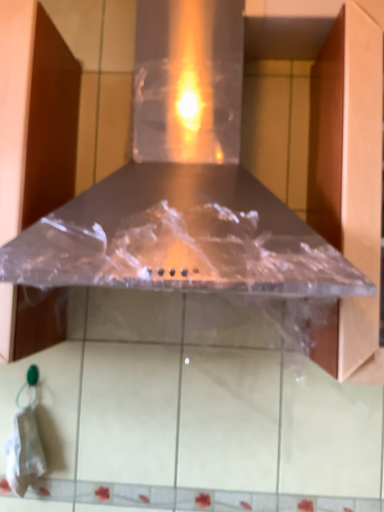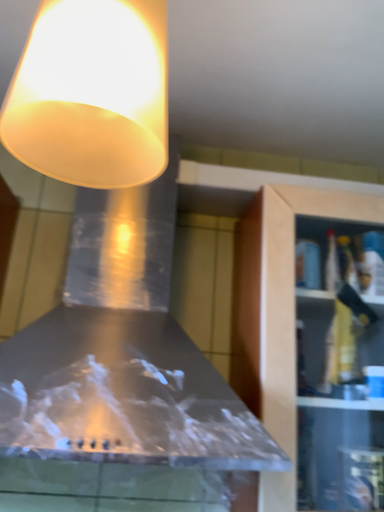
Question: How did the camera likely rotate when shooting the video?

Choices:
 (A) rotated right
 (B) rotated left

Answer: (A)